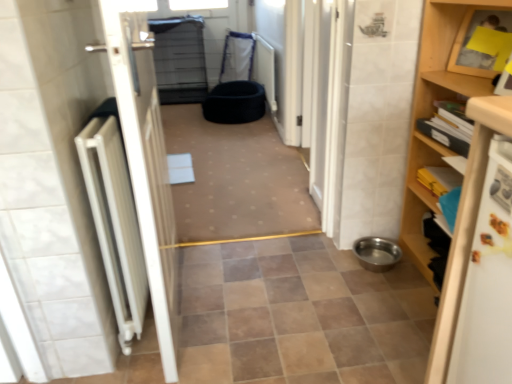
The image size is (512, 384). I want to click on wooden shelf at right, so click(433, 107).

In order to face white matte door at left, should I rotate leftwards or rightwards?

Turn left approximately 11.726 degrees to face it.

Measure the distance between point (131, 71) and camera.

Point (131, 71) is 37.36 inches from camera.

What do you see at coordinates (377, 253) in the screenshot?
I see `metallic stainless steel bowl at lower right, which is the second toilet bowl from back to front` at bounding box center [377, 253].

The width and height of the screenshot is (512, 384). Describe the element at coordinates (234, 102) in the screenshot. I see `black fabric pet bed at center, positioned as the first toilet bowl in left-to-right order` at that location.

Locate an element on the screen. The height and width of the screenshot is (384, 512). black fabric pet bed at center is located at coordinates (236, 179).

Locate an element on the screen. Image resolution: width=512 pixels, height=384 pixels. white glossy refrigerator at right is located at coordinates (488, 281).

The image size is (512, 384). Find the location of `wooden shelf at right`. wooden shelf at right is located at coordinates (433, 107).

Are black fabric pet bed at center and white matte door at left making contact?

No, black fabric pet bed at center is not in contact with white matte door at left.

Between black fabric pet bed at center and white matte door at left, which one has larger size?

black fabric pet bed at center is bigger.

Which point is more distant from viewer, (308, 208) or (175, 293)?

The point (308, 208) is farther from the camera.

From the image's perspective, which one is positioned lower, black fabric pet bed at center or white matte door at left?

From the image's view, white matte door at left is below.

From the image's perspective, is white metallic radiator at left located above or below black fabric pet bed at center, which is counted as the second toilet bowl, starting from the bottom?

white metallic radiator at left is situated lower than black fabric pet bed at center, which is counted as the second toilet bowl, starting from the bottom, in the image.

There is a black fabric pet bed at center, the 2th toilet bowl positioned from the right. Where is `radiator above it (from a real-world perspective)`? This screenshot has width=512, height=384. radiator above it (from a real-world perspective) is located at coordinates (115, 223).

Does point (120, 287) appear closer or farther from the camera than point (229, 109)?

Point (120, 287).

From a real-world perspective, between white metallic radiator at left and black fabric pet bed at center, which appears as the 1th toilet bowl when viewed from the top, who is vertically lower?

black fabric pet bed at center, which appears as the 1th toilet bowl when viewed from the top, is physically lower.

Is wooden shelf at right outside of white glossy refrigerator at right?

Absolutely, wooden shelf at right is external to white glossy refrigerator at right.

In the image, there is a white glossy refrigerator at right. Identify the location of shelf above it (from the image's perspective). (433, 107).

What's the angular difference between wooden shelf at right and white glossy refrigerator at right's facing directions?

The angle between the facing direction of wooden shelf at right and the facing direction of white glossy refrigerator at right is 1.38 degrees.

Is wooden shelf at right facing towards white glossy refrigerator at right?

No.

Which is closer, [105,230] or [441,327]?

Point [105,230] appears to be farther away from the viewer than point [441,327].

You are a GUI agent. You are given a task and a screenshot of the screen. Output one action in this format:
    pyautogui.click(x=<x>, y=<y>)
    Task: Click on the radiator behind the wooden shelf at right
    The height and width of the screenshot is (384, 512).
    Given the screenshot: What is the action you would take?
    pyautogui.click(x=115, y=223)

Measure the distance between white metallic radiator at left and wooden shelf at right.

The distance of white metallic radiator at left from wooden shelf at right is 1.11 meters.

Considering the sizes of white metallic radiator at left and wooden shelf at right in the image, is white metallic radiator at left wider or thinner than wooden shelf at right?

Considering their sizes, white metallic radiator at left looks broader than wooden shelf at right.

From the image's perspective, is black fabric pet bed at center on top of black fabric pet bed at center, which appears as the 1th toilet bowl when viewed from the top?

No, from the image's perspective, black fabric pet bed at center is not on top of black fabric pet bed at center, which appears as the 1th toilet bowl when viewed from the top.

Which is correct: black fabric pet bed at center is inside black fabric pet bed at center, which is counted as the second toilet bowl, starting from the bottom, or outside of it?

black fabric pet bed at center is not enclosed by black fabric pet bed at center, which is counted as the second toilet bowl, starting from the bottom.

Looking at the image, does black fabric pet bed at center seem bigger or smaller compared to black fabric pet bed at center, the 2th toilet bowl in the front-to-back sequence?

Clearly, black fabric pet bed at center is larger in size than black fabric pet bed at center, the 2th toilet bowl in the front-to-back sequence.

Does black fabric pet bed at center have a greater height compared to black fabric pet bed at center, which appears as the 1th toilet bowl when viewed from the top?

In fact, black fabric pet bed at center may be shorter than black fabric pet bed at center, which appears as the 1th toilet bowl when viewed from the top.

Is black fabric pet bed at center looking in the opposite direction of white glossy refrigerator at right?

black fabric pet bed at center does not have its back to white glossy refrigerator at right.

From a real-world perspective, relative to white glossy refrigerator at right, is black fabric pet bed at center vertically above or below?

black fabric pet bed at center is below white glossy refrigerator at right.

Which is more to the left, black fabric pet bed at center or white glossy refrigerator at right?

Positioned to the left is black fabric pet bed at center.

From the picture: Considering the relative sizes of metallic stainless steel bowl at lower right, which is the second toilet bowl from back to front, and white glossy refrigerator at right in the image provided, is metallic stainless steel bowl at lower right, which is the second toilet bowl from back to front, wider than white glossy refrigerator at right?

Indeed, metallic stainless steel bowl at lower right, which is the second toilet bowl from back to front, has a greater width compared to white glossy refrigerator at right.

This screenshot has width=512, height=384. I want to click on the 2nd toilet bowl below the white glossy refrigerator at right (from a real-world perspective), so click(x=377, y=253).

The width and height of the screenshot is (512, 384). I want to click on plain that appears behind the white matte door at left, so click(236, 179).

Identify the location of radiator lying in front of the black fabric pet bed at center, the 2th toilet bowl in the front-to-back sequence. (115, 223).

Based on their spatial positions, is wooden shelf at right or white metallic radiator at left closer to black fabric pet bed at center?

white metallic radiator at left lies closer to black fabric pet bed at center than the other object.

When comparing their distances from metallic stainless steel bowl at lower right, which is the 1th toilet bowl from right to left, does white glossy refrigerator at right or black fabric pet bed at center, positioned as the first toilet bowl in left-to-right order, seem closer?

white glossy refrigerator at right lies closer to metallic stainless steel bowl at lower right, which is the 1th toilet bowl from right to left, than the other object.

From the image, which object appears to be farther from black fabric pet bed at center, the first toilet bowl positioned from the back, white matte door at left or metallic stainless steel bowl at lower right, which is the second toilet bowl from back to front?

Based on the image, white matte door at left appears to be further to black fabric pet bed at center, the first toilet bowl positioned from the back.

When comparing their distances from metallic stainless steel bowl at lower right, arranged as the 2th toilet bowl when viewed from the top, does wooden shelf at right or white matte door at left seem further?

white matte door at left lies further to metallic stainless steel bowl at lower right, arranged as the 2th toilet bowl when viewed from the top, than the other object.

Which object lies further to the anchor point white matte door at left, black fabric pet bed at center, which appears as the 1th toilet bowl when viewed from the top, or white glossy refrigerator at right?

Among the two, black fabric pet bed at center, which appears as the 1th toilet bowl when viewed from the top, is located further to white matte door at left.

Estimate the real-world distances between objects in this image. Which object is further from white metallic radiator at left, metallic stainless steel bowl at lower right, arranged as the 2th toilet bowl when viewed from the top, or black fabric pet bed at center?

black fabric pet bed at center lies further to white metallic radiator at left than the other object.

From the image, which object appears to be farther from black fabric pet bed at center, white glossy refrigerator at right or wooden shelf at right?

white glossy refrigerator at right is positioned further to the anchor black fabric pet bed at center.

In the scene shown: Looking at the image, which one is located closer to white glossy refrigerator at right, metallic stainless steel bowl at lower right, the first toilet bowl in the front-to-back sequence, or wooden shelf at right?

wooden shelf at right is positioned closer to the anchor white glossy refrigerator at right.

In order to click on plain between white metallic radiator at left and wooden shelf at right in this screenshot , I will do `click(236, 179)`.

At what (x,y) coordinates should I click in order to perform the action: click on door between white metallic radiator at left and metallic stainless steel bowl at lower right, the first toilet bowl in the front-to-back sequence, in the horizontal direction. Please return your answer as a coordinate pair (x, y). Looking at the image, I should click on (145, 157).

Where is `radiator positioned between white matte door at left and black fabric pet bed at center from near to far`? radiator positioned between white matte door at left and black fabric pet bed at center from near to far is located at coordinates (115, 223).

Where is `shelf between white glossy refrigerator at right and black fabric pet bed at center, the 2th toilet bowl in the front-to-back sequence, from front to back`? The height and width of the screenshot is (384, 512). shelf between white glossy refrigerator at right and black fabric pet bed at center, the 2th toilet bowl in the front-to-back sequence, from front to back is located at coordinates (433, 107).